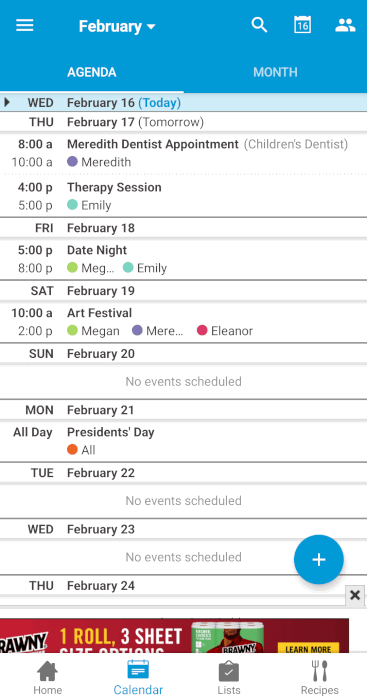
Locate an element on the screen. Image resolution: width=367 pixels, height=700 pixels. fork is located at coordinates (320, 673).